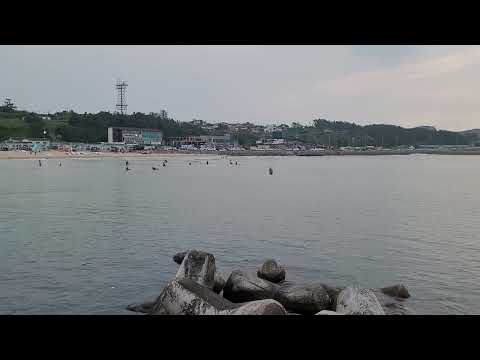
You are a GUI agent. You are given a task and a screenshot of the screen. Output one action in this format:
    pyautogui.click(x=<x>, y=<y>)
    Task: Click on the hotel
    The width and height of the screenshot is (480, 360).
    Given the screenshot: What is the action you would take?
    pyautogui.click(x=31, y=138)